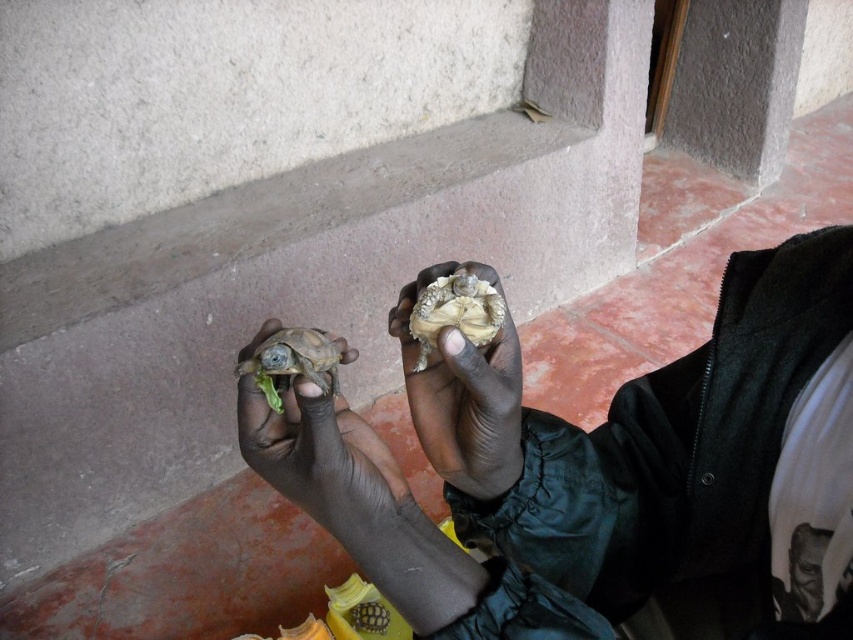
You are a photographer trying to capture both turtles in a single shot. Given their positions at point (x=508, y=355) and point (x=257, y=353), which turtle should you focus on first to ensure both are in focus?

You should focus on the turtle at point (x=257, y=353) first because it is closer to the camera than the turtle at point (x=508, y=355), which is behind it. This way, both turtles will be in focus when using a shallow depth of field.

You are a veterinarian checking the health of two turtles. You have a measuring tool that can only measure up to 2 inches. Can you determine the distance between the smooth brown tortoise at center and the brown matte turtle at center using your tool?

The distance between the smooth brown tortoise at center and the brown matte turtle at center is 2.76 inches, which is longer than the measuring tool can handle. Therefore, you cannot measure the distance between the smooth brown tortoise at center and the brown matte turtle at center with your current tool.

You are a wildlife photographer trying to capture a photo of the smooth brown tortoise at center and the smooth green tortoise at center. Since you want to ensure both are visible in the frame, which tortoise should you focus on first to make sure the lower one is in focus?

The smooth brown tortoise at center is located below the smooth green tortoise at center, so you should focus on the smooth brown tortoise at center first to ensure the lower one is in focus.